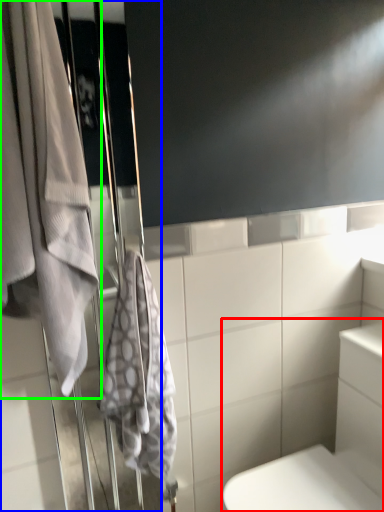
Question: Which is farther away from bath (highlighted by a red box)? screen door (highlighted by a blue box) or towel (highlighted by a green box)?

Choices:
 (A) screen door
 (B) towel

Answer: (B)